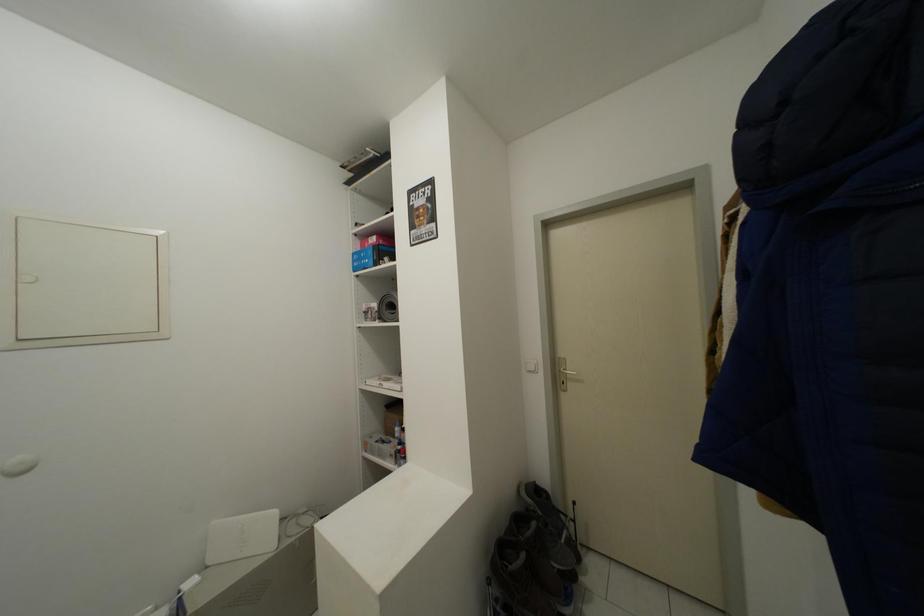
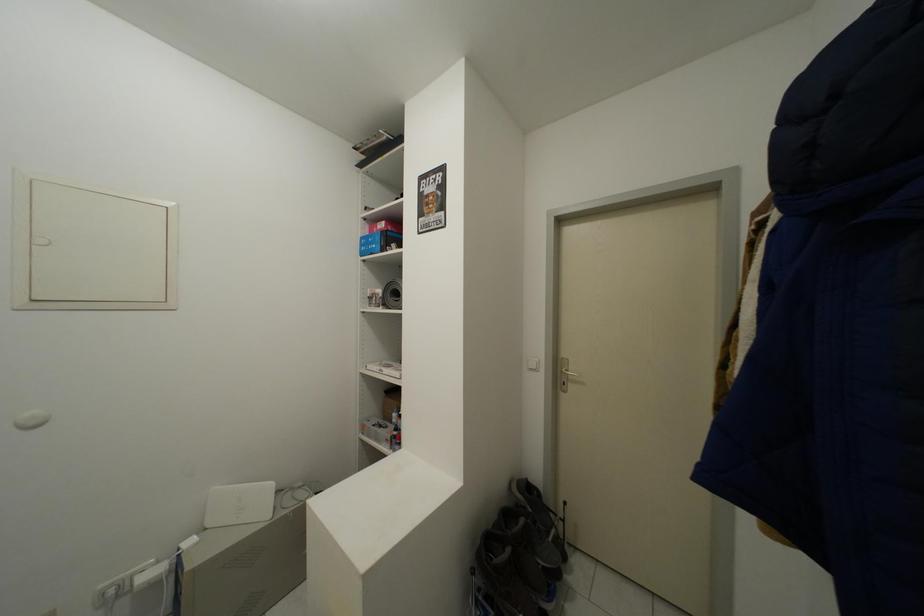
What movement of the cameraman would produce the second image?

The movement direction of the cameraman is right, forward.